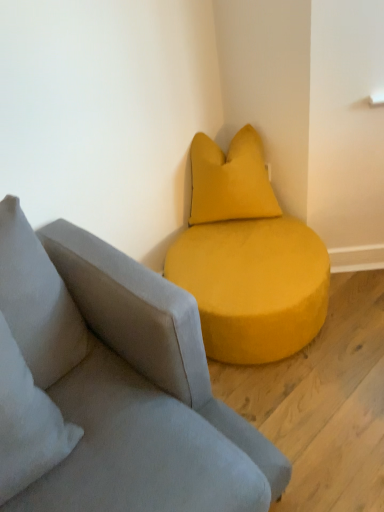
Question: Visually, is suede gray studio couch at center positioned to the left or to the right of velvet yellow pillow at upper right?

Choices:
 (A) left
 (B) right

Answer: (B)

Question: From the image's perspective, is suede gray studio couch at center located above or below velvet yellow pillow at upper right?

Choices:
 (A) below
 (B) above

Answer: (A)

Question: Is suede gray studio couch at center bigger or smaller than velvet yellow pillow at upper right?

Choices:
 (A) small
 (B) big

Answer: (B)

Question: Looking at their shapes, would you say velvet yellow pillow at upper right is wider or thinner than suede gray studio couch at center?

Choices:
 (A) wide
 (B) thin

Answer: (B)

Question: Considering the positions of point (228, 212) and point (109, 429), is point (228, 212) closer or farther from the camera than point (109, 429)?

Choices:
 (A) closer
 (B) farther

Answer: (B)

Question: Do you think velvet yellow pillow at upper right is within suede gray studio couch at center, or outside of it?

Choices:
 (A) inside
 (B) outside

Answer: (B)

Question: Is velvet yellow pillow at upper right taller or shorter than suede gray studio couch at center?

Choices:
 (A) short
 (B) tall

Answer: (B)